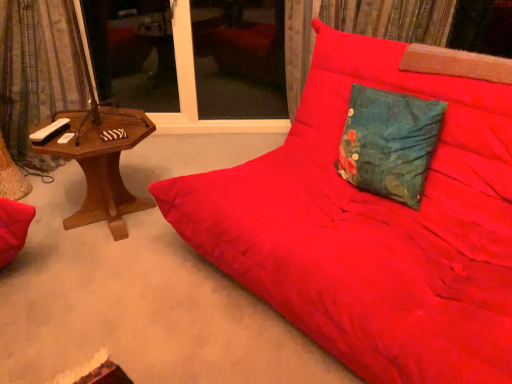
Question: Is velvet-like curtain at left oriented away from woodenmaterial/texturetable at left?

Choices:
 (A) yes
 (B) no

Answer: (B)

Question: Is velvet-like curtain at left next to woodenmaterial/texturetable at left?

Choices:
 (A) yes
 (B) no

Answer: (B)

Question: From the image's perspective, is velvet-like curtain at left located above woodenmaterial/texturetable at left?

Choices:
 (A) no
 (B) yes

Answer: (B)

Question: Is velvet-like curtain at left in front of woodenmaterial/texturetable at left?

Choices:
 (A) yes
 (B) no

Answer: (B)

Question: Considering the relative sizes of velvet-like curtain at left and woodenmaterial/texturetable at left in the image provided, is velvet-like curtain at left smaller than woodenmaterial/texturetable at left?

Choices:
 (A) no
 (B) yes

Answer: (A)

Question: In terms of size, does teal floral fabric pillow at center appear bigger or smaller than matte red fabric studio couch at center?

Choices:
 (A) small
 (B) big

Answer: (A)

Question: Considering the positions of teal floral fabric pillow at center and matte red fabric studio couch at center in the image, is teal floral fabric pillow at center taller or shorter than matte red fabric studio couch at center?

Choices:
 (A) tall
 (B) short

Answer: (B)

Question: Is teal floral fabric pillow at center spatially inside matte red fabric studio couch at center, or outside of it?

Choices:
 (A) outside
 (B) inside

Answer: (B)

Question: Based on their positions, is teal floral fabric pillow at center located to the left or right of matte red fabric studio couch at center?

Choices:
 (A) left
 (B) right

Answer: (B)

Question: Looking at the image, does teal floral fabric pillow at center seem bigger or smaller compared to woodenmaterial/texturetable at left?

Choices:
 (A) small
 (B) big

Answer: (A)

Question: Is teal floral fabric pillow at center inside or outside of woodenmaterial/texturetable at left?

Choices:
 (A) inside
 (B) outside

Answer: (B)

Question: Is teal floral fabric pillow at center wider or thinner than woodenmaterial/texturetable at left?

Choices:
 (A) thin
 (B) wide

Answer: (A)

Question: Considering their positions, is teal floral fabric pillow at center located in front of or behind woodenmaterial/texturetable at left?

Choices:
 (A) behind
 (B) front

Answer: (B)

Question: Is transparent glass window at center, which is the 1th window screen in right-to-left order, to the left or to the right of teal floral fabric pillow at center in the image?

Choices:
 (A) right
 (B) left

Answer: (B)

Question: Based on their sizes in the image, would you say transparent glass window at center, which is the 1th window screen in right-to-left order, is bigger or smaller than teal floral fabric pillow at center?

Choices:
 (A) small
 (B) big

Answer: (B)